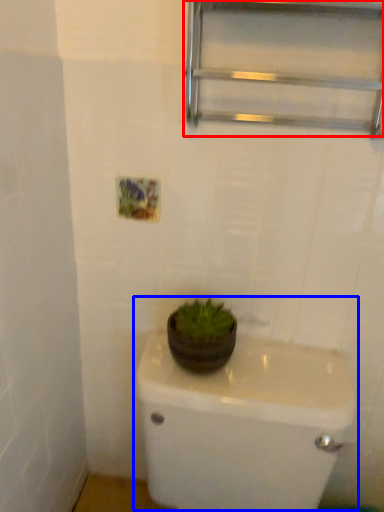
Question: Which of the following is the closest to the observer, shelf (highlighted by a red box) or sink (highlighted by a blue box)?

Choices:
 (A) shelf
 (B) sink

Answer: (B)